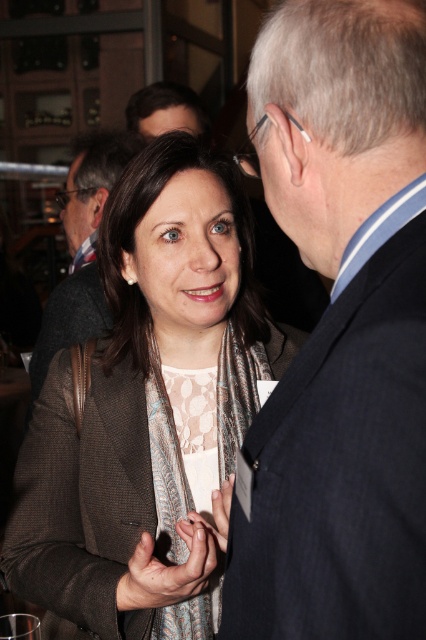
Question: Can you confirm if dark blue suit at center is thinner than matte silver ring at center?

Choices:
 (A) yes
 (B) no

Answer: (B)

Question: Can you confirm if brown textured blazer at center is bigger than matte silver ring at center?

Choices:
 (A) yes
 (B) no

Answer: (A)

Question: Which of the following is the closest to the observer?

Choices:
 (A) (89, 417)
 (B) (2, 634)

Answer: (B)

Question: Does smooth skin hand at center appear on the right side of transparent glass at upper center?

Choices:
 (A) no
 (B) yes

Answer: (B)

Question: Considering the real-world distances, which object is closest to the dark blue suit at center?

Choices:
 (A) smooth skin hand at center
 (B) brown textured blazer at center
 (C) dark gray suit at center

Answer: (A)

Question: Which of the following is the farthest from the observer?

Choices:
 (A) dark blue suit at center
 (B) smooth skin hand at center
 (C) transparent glass at upper center

Answer: (B)